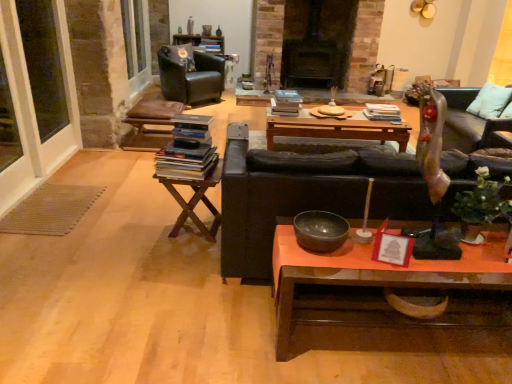
Question: Considering the relative sizes of metallic silver couch at right and matte red picture frame at center in the image provided, is metallic silver couch at right thinner than matte red picture frame at center?

Choices:
 (A) yes
 (B) no

Answer: (B)

Question: Considering the relative positions of metallic silver couch at right and matte red picture frame at center in the image provided, is metallic silver couch at right to the left of matte red picture frame at center from the viewer's perspective?

Choices:
 (A) yes
 (B) no

Answer: (B)

Question: Considering the relative sizes of metallic silver couch at right and matte red picture frame at center in the image provided, is metallic silver couch at right bigger than matte red picture frame at center?

Choices:
 (A) no
 (B) yes

Answer: (B)

Question: Is metallic silver couch at right closer to camera compared to matte red picture frame at center?

Choices:
 (A) no
 (B) yes

Answer: (A)

Question: Is metallic silver couch at right outside matte red picture frame at center?

Choices:
 (A) no
 (B) yes

Answer: (B)

Question: From a real-world perspective, does metallic silver couch at right stand above matte red picture frame at center?

Choices:
 (A) no
 (B) yes

Answer: (A)

Question: Does wooden polished coffee table at lower center, marked as the second coffee table in a back-to-front arrangement, have a lesser height compared to metallic silver couch at right?

Choices:
 (A) no
 (B) yes

Answer: (B)

Question: Is wooden polished coffee table at lower center, which is the 1th coffee table from front to back, further to the viewer compared to metallic silver couch at right?

Choices:
 (A) yes
 (B) no

Answer: (B)

Question: Is there a large distance between wooden polished coffee table at lower center, marked as the second coffee table in a back-to-front arrangement, and metallic silver couch at right?

Choices:
 (A) no
 (B) yes

Answer: (A)

Question: Is wooden polished coffee table at lower center, which is the 1th coffee table from front to back, to the left of metallic silver couch at right from the viewer's perspective?

Choices:
 (A) no
 (B) yes

Answer: (B)

Question: Does wooden polished coffee table at lower center, which is the 1th coffee table from front to back, have a greater width compared to metallic silver couch at right?

Choices:
 (A) yes
 (B) no

Answer: (B)

Question: Could metallic silver couch at right be considered to be inside wooden polished coffee table at lower center, the 1th coffee table ordered from the bottom?

Choices:
 (A) yes
 (B) no

Answer: (B)

Question: Does hardcover books at center, the second book viewed from the front, have a smaller size compared to wooden polished coffee table at lower center, marked as the second coffee table in a back-to-front arrangement?

Choices:
 (A) no
 (B) yes

Answer: (B)